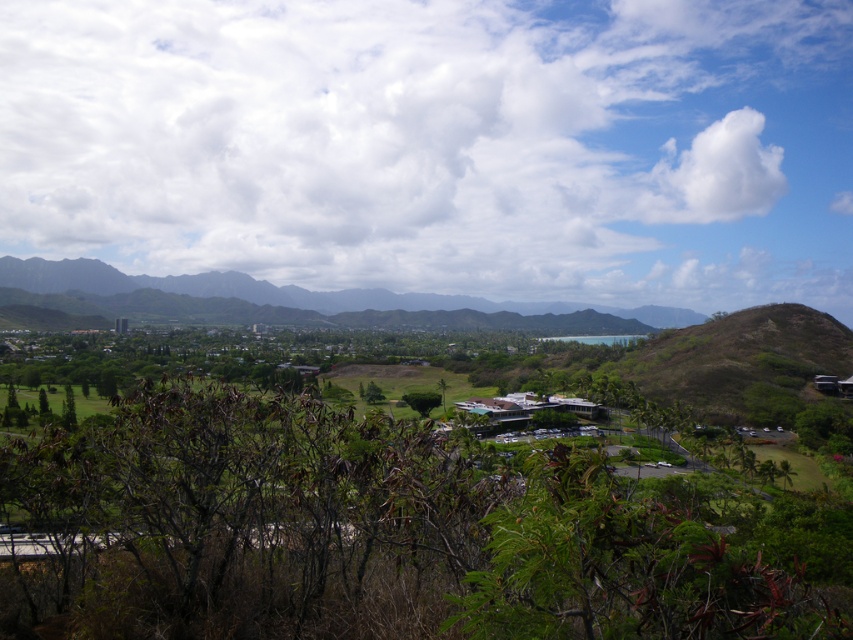
You are an airplane pilot preparing for takeoff and you notice two white fluffy clouds in the sky. You see the white fluffy cloud at upper center and the white fluffy cloud at upper right. Which cloud is larger in size?

The white fluffy cloud at upper center is bigger than the white fluffy cloud at upper right, so the white fluffy cloud at upper center is larger in size.

You are a drone operator planning to fly a drone from the green leafy shrubs at center to the white fluffy cloud at upper center. Given the drone has a maximum flight range of 2000 feet, will it be able to reach the cloud?

The distance between the green leafy shrubs at center and the white fluffy cloud at upper center is 2041.72 feet, which exceeds the drone operator maximum flight range of 2000 feet. Therefore, the drone will not be able to reach the cloud.